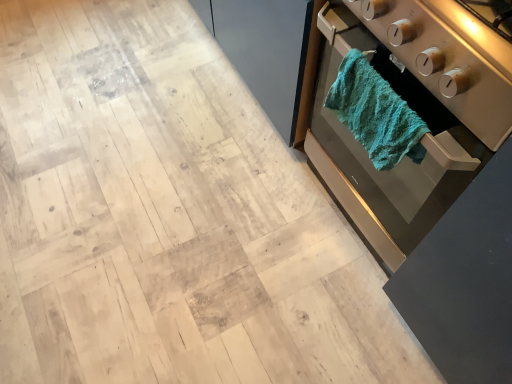
The image size is (512, 384). Describe the element at coordinates (449, 58) in the screenshot. I see `teal fabric towel at right` at that location.

Looking at this image, measure the distance between teal textured towel at right and camera.

teal textured towel at right and camera are 30.20 inches apart from each other.

Describe the element at coordinates (413, 109) in the screenshot. I see `teal fabric towel at right` at that location.

Identify the location of teal fabric towel at right. (449, 58).

Would you say teal textured towel at right is outside teal fabric towel at right?

No, most part of teal textured towel at right lies within teal fabric towel at right.

Considering the sizes of objects teal textured towel at right and teal fabric towel at right in the image provided, who is wider, teal textured towel at right or teal fabric towel at right?

Wider between the two is teal fabric towel at right.

Does teal textured towel at right turn towards teal fabric towel at right?

No, teal textured towel at right does not turn towards teal fabric towel at right.

Considering their positions, is teal textured towel at right located in front of or behind teal fabric towel at right?

Clearly, teal textured towel at right is behind teal fabric towel at right.

Considering the sizes of objects teal fabric towel at right and teal fabric towel at right in the image provided, who is shorter, teal fabric towel at right or teal fabric towel at right?

Standing shorter between the two is teal fabric towel at right.

Does point (456, 41) come in front of point (505, 65)?

No.

Is teal fabric towel at right next to teal fabric towel at right?

No, teal fabric towel at right is not touching teal fabric towel at right.

Is teal fabric towel at right not inside teal fabric towel at right?

Yes, teal fabric towel at right is outside of teal fabric towel at right.

Where is `appliance above the teal textured towel at right (from a real-world perspective)`? This screenshot has width=512, height=384. appliance above the teal textured towel at right (from a real-world perspective) is located at coordinates (449, 58).

Consider the image. Can you confirm if teal fabric towel at right is positioned to the right of teal textured towel at right?

Yes.

How many degrees apart are the facing directions of teal fabric towel at right and teal textured towel at right?

teal fabric towel at right and teal textured towel at right are facing 1.74 degrees away from each other.

Considering the sizes of teal fabric towel at right and teal textured towel at right in the image, is teal fabric towel at right taller or shorter than teal textured towel at right?

In the image, teal fabric towel at right appears to be shorter than teal textured towel at right.

In the image, there is a teal fabric towel at right. Identify the location of bath towel below it (from the image's perspective). (375, 113).

From a real-world perspective, who is located lower, teal fabric towel at right or teal textured towel at right?

teal fabric towel at right is physically lower.

Which is less distant, (428, 112) or (344, 58)?

Point (428, 112) is positioned closer to the camera compared to point (344, 58).

Can you tell me how much teal textured towel at right and teal fabric towel at right differ in facing direction?

1.74 degrees separate the facing orientations of teal textured towel at right and teal fabric towel at right.

Between teal textured towel at right and teal fabric towel at right, which one has more height?

Standing taller between the two is teal textured towel at right.

Between teal textured towel at right and teal fabric towel at right, which one has smaller size?

Smaller between the two is teal textured towel at right.

Is teal fabric towel at right at the back of teal textured towel at right?

No, teal textured towel at right is not facing the opposite direction of teal fabric towel at right.

Is teal fabric towel at right to the left or to the right of teal fabric towel at right in the image?

Clearly, teal fabric towel at right is on the right of teal fabric towel at right in the image.

Looking at this image, does teal fabric towel at right have a greater height compared to teal fabric towel at right?

Yes, teal fabric towel at right is taller than teal fabric towel at right.

Considering the sizes of objects teal fabric towel at right and teal fabric towel at right in the image provided, who is bigger, teal fabric towel at right or teal fabric towel at right?

teal fabric towel at right is bigger.

What are the coordinates of `bath towel located on the left of teal fabric towel at right` in the screenshot? It's located at (375, 113).

Identify the location of home appliance directly beneath the teal fabric towel at right (from a real-world perspective). The image size is (512, 384). (413, 109).

From the image, which object appears to be farther from teal fabric towel at right, teal textured towel at right or teal fabric towel at right?

teal fabric towel at right is further to teal fabric towel at right.

Which object lies further to the anchor point teal fabric towel at right, teal fabric towel at right or teal textured towel at right?

teal fabric towel at right is positioned further to the anchor teal fabric towel at right.

Which object lies nearer to the anchor point teal fabric towel at right, teal textured towel at right or teal fabric towel at right?

teal textured towel at right is positioned closer to the anchor teal fabric towel at right.

In the scene shown: When comparing their distances from teal textured towel at right, does teal fabric towel at right or teal fabric towel at right seem closer?

teal fabric towel at right is positioned closer to the anchor teal textured towel at right.

Which object lies nearer to the anchor point teal fabric towel at right, teal fabric towel at right or teal textured towel at right?

teal textured towel at right is positioned closer to the anchor teal fabric towel at right.

Estimate the real-world distances between objects in this image. Which object is closer to teal textured towel at right, teal fabric towel at right or teal fabric towel at right?

The object closer to teal textured towel at right is teal fabric towel at right.

At what (x,y) coordinates should I click in order to perform the action: click on appliance located between teal textured towel at right and teal fabric towel at right in the left-right direction. Please return your answer as a coordinate pair (x, y). This screenshot has width=512, height=384. Looking at the image, I should click on point(449,58).